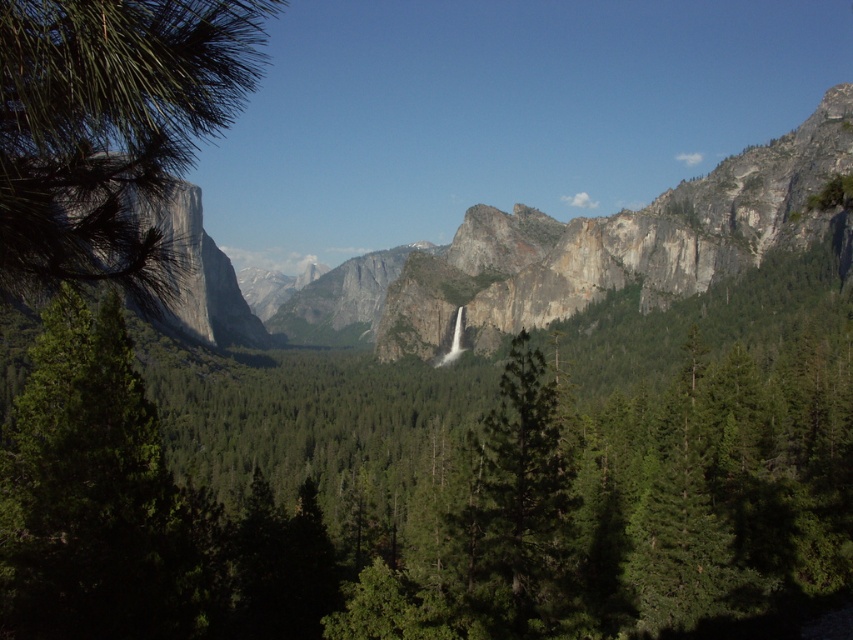
Can you confirm if green matte pine forest at center is wider than green needle-like at left?

Yes.

Locate an element on the screen. The image size is (853, 640). green matte pine forest at center is located at coordinates (437, 477).

Find the location of a particular element. Image resolution: width=853 pixels, height=640 pixels. green matte pine forest at center is located at coordinates (437, 477).

Does green needle-like at left come in front of green matte tree at center?

Yes.

Who is more distant from viewer, (22,38) or (521,604)?

Positioned behind is point (521,604).

Find the location of `green needle-like at left`. green needle-like at left is located at coordinates (109, 129).

Can you confirm if green matte pine forest at center is taller than green matte tree at center?

Indeed, green matte pine forest at center has a greater height compared to green matte tree at center.

What do you see at coordinates (437, 477) in the screenshot? This screenshot has height=640, width=853. I see `green matte pine forest at center` at bounding box center [437, 477].

Between point (584, 625) and point (527, 548), which one is positioned behind?

The point (527, 548) is behind.

At what (x,y) coordinates should I click in order to perform the action: click on green matte pine forest at center. Please return your answer as a coordinate pair (x, y). Image resolution: width=853 pixels, height=640 pixels. Looking at the image, I should click on (437, 477).